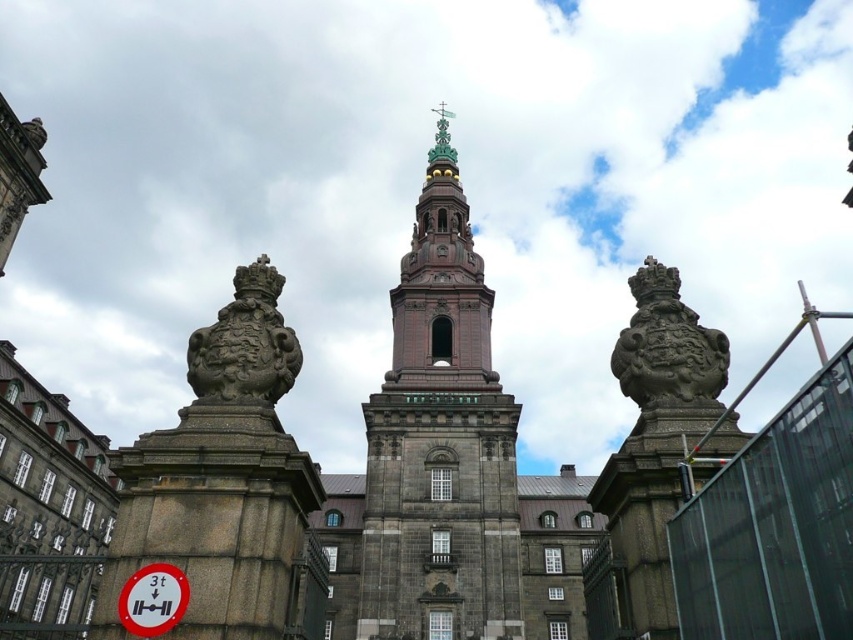
Can you confirm if dark gray stone tower at center is thinner than stone carved emblem at center?

Incorrect, dark gray stone tower at center's width is not less than stone carved emblem at center's.

Does dark gray stone tower at center come behind stone carved emblem at center?

Yes, dark gray stone tower at center is further from the viewer.

What do you see at coordinates (440, 442) in the screenshot? The height and width of the screenshot is (640, 853). I see `dark gray stone tower at center` at bounding box center [440, 442].

This screenshot has height=640, width=853. I want to click on dark gray stone tower at center, so click(x=440, y=442).

Who is more distant from viewer, (209, 388) or (154, 573)?

The point (209, 388) is more distant.

The height and width of the screenshot is (640, 853). What are the coordinates of `stone carved emblem at center` in the screenshot? It's located at (245, 344).

Find the location of a particular element. stone carved emblem at center is located at coordinates (245, 344).

This screenshot has width=853, height=640. What are the coordinates of `stone carved emblem at center` in the screenshot? It's located at (245, 344).

Does dark gray stone tower at center have a larger size compared to white plastic sign at lower left?

Indeed, dark gray stone tower at center has a larger size compared to white plastic sign at lower left.

Does dark gray stone tower at center appear on the right side of white plastic sign at lower left?

Correct, you'll find dark gray stone tower at center to the right of white plastic sign at lower left.

Is point (434, 490) positioned after point (129, 620)?

Yes, it is behind point (129, 620).

The image size is (853, 640). In order to click on dark gray stone tower at center in this screenshot , I will do `click(440, 442)`.